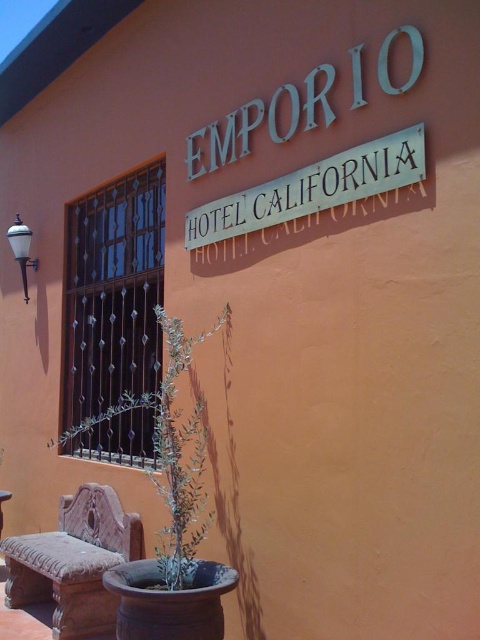
You are standing in front of the building and want to sit down. Where is the terracotta carved bench at lower left located relative to the sign?

The terracotta carved bench at lower left is located at coordinates point (73,561), which is to the lower left of the sign.

You are standing in front of the building and want to know which object is taller between the metallic silver sign at upper center and the green leafy plant at center. Can you tell me?

The metallic silver sign at upper center is shorter than the green leafy plant at center, so the green leafy plant at center is taller.

You are standing in front of the building and see two points marked on the wall. The first point is at coordinates point (x=350, y=150) and the second is at point (x=158, y=397). Which point is closer to you?

Point (x=350, y=150) is in front of point (x=158, y=397), so it is closer to you.